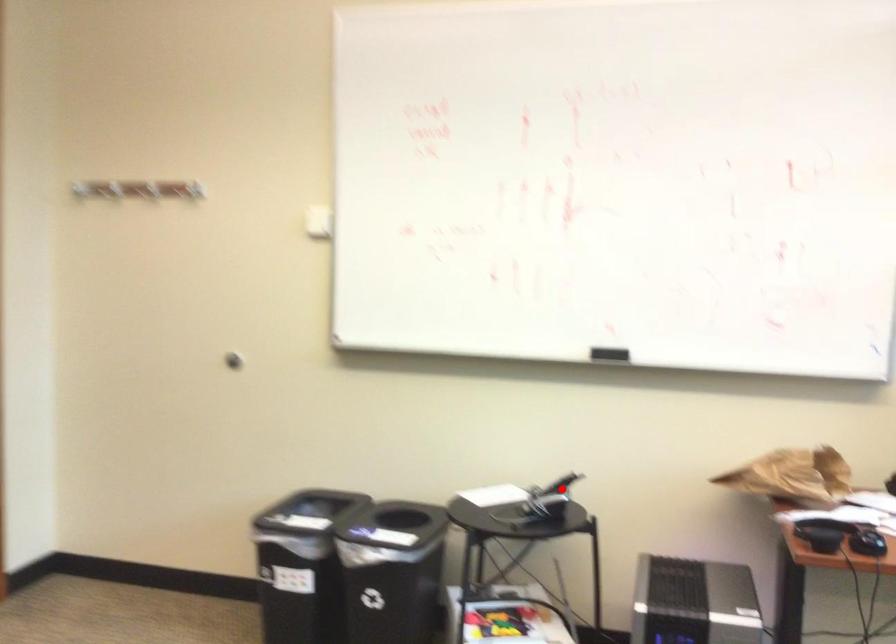
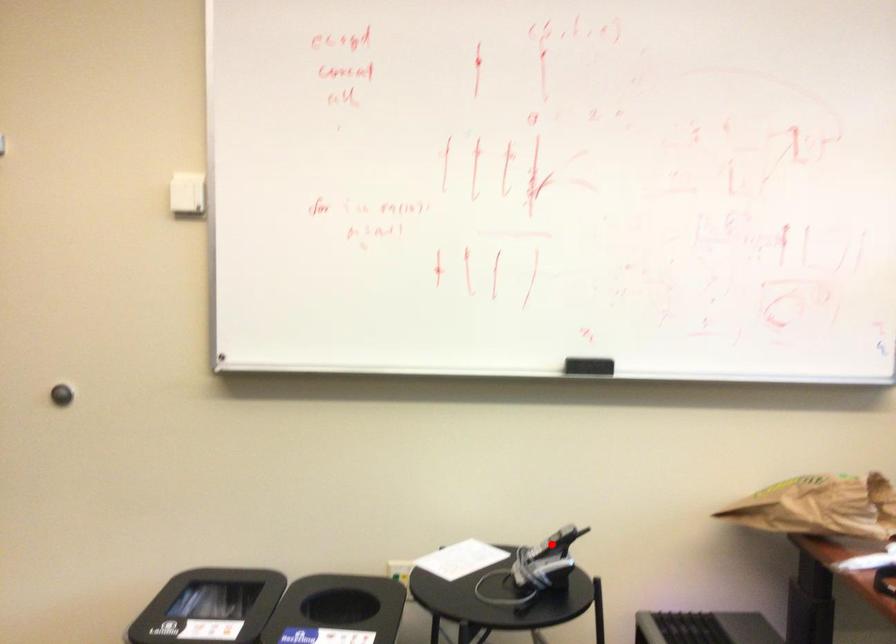
I am providing you with two images of the same scene from different viewpoints. A red point is marked on the first image and another point is marked on the second image. Do the highlighted points in image1 and image2 indicate the same real-world spot?

Yes